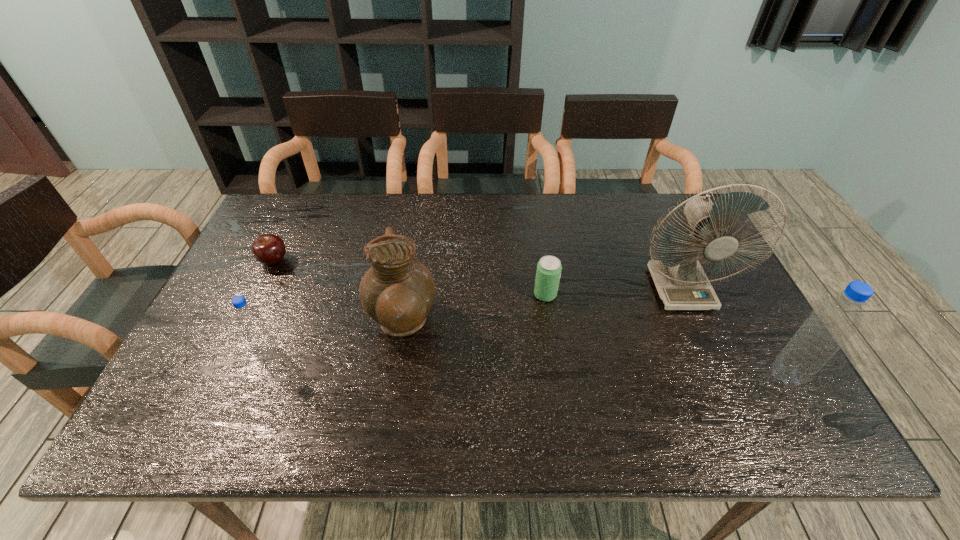
Identify the location of free space between the fourth object from left to right and the pitcher. This screenshot has height=540, width=960. (473, 309).

This screenshot has height=540, width=960. Find the location of `unoccupied position between the third object from left to right and the tallest object`. unoccupied position between the third object from left to right and the tallest object is located at coordinates (541, 307).

This screenshot has width=960, height=540. I want to click on free space between the left water bottle and the apple, so click(x=272, y=308).

In order to click on unoccupied area between the pitcher and the apple in this screenshot , I will do `click(338, 293)`.

The width and height of the screenshot is (960, 540). I want to click on unoccupied position between the pitcher and the taller water bottle, so click(x=594, y=350).

This screenshot has width=960, height=540. In order to click on vacant area that lies between the second shortest object and the fourth object from right to left in this screenshot , I will do `click(473, 309)`.

Locate which object is the fifth closest to the third object from left to right. Please provide its 2D coordinates. Your answer should be formatted as a tuple, i.e. [(x, y)], where the tuple contains the x and y coordinates of a point satisfying the conditions above.

[(830, 324)]

Where is `object that is the fourth closest one to the apple`? The height and width of the screenshot is (540, 960). object that is the fourth closest one to the apple is located at coordinates pos(680,280).

This screenshot has height=540, width=960. What are the coordinates of `vacant area in the image that satisfies the following two spatial constraints: 1. on the front-facing side of the tallest object; 2. at the spout of the pitcher` in the screenshot? It's located at (696, 325).

Locate an element on the screen. The height and width of the screenshot is (540, 960). vacant space that satisfies the following two spatial constraints: 1. at the spout of the taller water bottle; 2. on the left side of the fourth object from right to left is located at coordinates (394, 376).